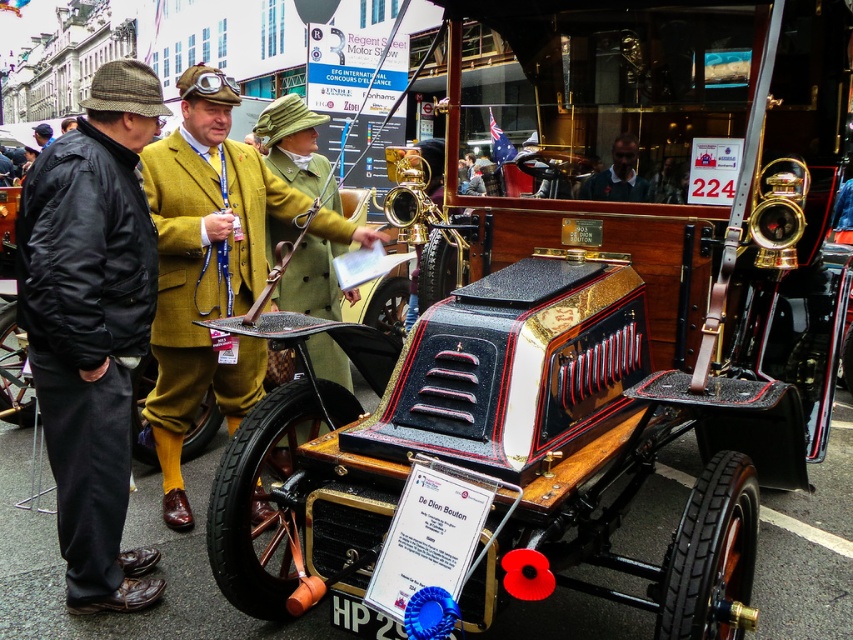
Question: Does wooden coach at left come in front of brown leather hat at upper left?

Choices:
 (A) yes
 (B) no

Answer: (A)

Question: Is dark blue sweater at center closer to camera compared to brown leather hat at upper left?

Choices:
 (A) no
 (B) yes

Answer: (B)

Question: Which point is closer to the camera?

Choices:
 (A) dark blue sweater at center
 (B) brown leather hat at upper left

Answer: (A)

Question: Among these objects, which one is nearest to the camera?

Choices:
 (A) mustard wool suit at center
 (B) dark blue sweater at center

Answer: (A)

Question: Does dark blue sweater at center have a lesser width compared to brown leather hat at upper left?

Choices:
 (A) yes
 (B) no

Answer: (A)

Question: Which is nearer to the mustard wool suit at center?

Choices:
 (A) wooden coach at left
 (B) brown leather hat at upper left

Answer: (A)